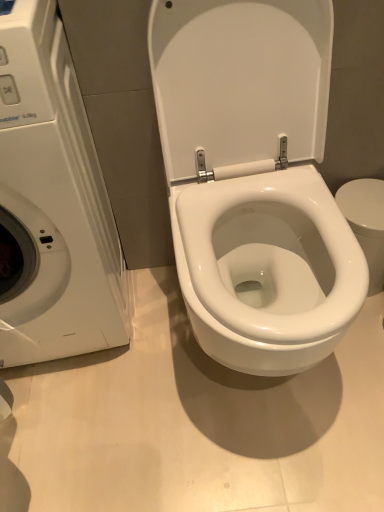
The width and height of the screenshot is (384, 512). I want to click on white glossy toilet at center, so click(253, 180).

What do you see at coordinates (253, 180) in the screenshot? This screenshot has width=384, height=512. I see `white glossy toilet at center` at bounding box center [253, 180].

Describe the element at coordinates (52, 203) in the screenshot. I see `white glossy washing machine at left` at that location.

Identify the location of white glossy washing machine at left. Image resolution: width=384 pixels, height=512 pixels. (52, 203).

I want to click on white glossy toilet at center, so click(253, 180).

Is white glossy washing machine at left to the left or to the right of white glossy toilet at center in the image?

In the image, white glossy washing machine at left appears on the left side of white glossy toilet at center.

In the scene shown: Considering the positions of objects white glossy washing machine at left and white glossy toilet at center in the image provided, who is behind, white glossy washing machine at left or white glossy toilet at center?

Positioned behind is white glossy toilet at center.

Which is less distant, (59,328) or (276,67)?

Point (59,328) appears to be farther away from the viewer than point (276,67).

From the image's perspective, which one is positioned higher, white glossy washing machine at left or white glossy toilet at center?

white glossy toilet at center is shown above in the image.

From a real-world perspective, who is located lower, white glossy washing machine at left or white glossy toilet at center?

In real-world perspective, white glossy washing machine at left is lower.

From the picture: Looking at their sizes, would you say white glossy washing machine at left is wider or thinner than white glossy toilet at center?

In the image, white glossy washing machine at left appears to be wider than white glossy toilet at center.

Considering the sizes of objects white glossy washing machine at left and white glossy toilet at center in the image provided, who is taller, white glossy washing machine at left or white glossy toilet at center?

With more height is white glossy toilet at center.

From the picture: Which of these two, white glossy washing machine at left or white glossy toilet at center, is bigger?

white glossy washing machine at left.

Is white glossy washing machine at left situated inside white glossy toilet at center or outside?

white glossy washing machine at left lies outside white glossy toilet at center.

Is white glossy washing machine at left placed right next to white glossy toilet at center?

white glossy washing machine at left and white glossy toilet at center are clearly separated.

Is white glossy washing machine at left turned away from white glossy toilet at center?

No, white glossy washing machine at left is not facing the opposite direction of white glossy toilet at center.

Can you tell me how much white glossy washing machine at left and white glossy toilet at center differ in facing direction?

The facing directions of white glossy washing machine at left and white glossy toilet at center are 0.000215 degrees apart.

The width and height of the screenshot is (384, 512). Find the location of `washing machine in front of the white glossy toilet at center`. washing machine in front of the white glossy toilet at center is located at coordinates (52, 203).

Which is more to the right, white glossy toilet at center or white glossy washing machine at left?

white glossy toilet at center.

Is white glossy toilet at center in front of white glossy washing machine at left?

No, the depth of white glossy toilet at center is greater than that of white glossy washing machine at left.

Between point (239, 240) and point (25, 172), which one is positioned in front?

The point (25, 172) is in front.

From the image's perspective, is white glossy toilet at center over white glossy washing machine at left?

Yes, from the image's perspective, white glossy toilet at center is above white glossy washing machine at left.

From a real-world perspective, is white glossy toilet at center below white glossy washing machine at left?

Incorrect, from a real-world perspective, white glossy toilet at center is higher than white glossy washing machine at left.

Between white glossy toilet at center and white glossy washing machine at left, which one has smaller width?

Thinner between the two is white glossy toilet at center.

Does white glossy toilet at center have a lesser height compared to white glossy washing machine at left?

Incorrect, the height of white glossy toilet at center does not fall short of that of white glossy washing machine at left.

Based on their sizes in the image, would you say white glossy toilet at center is bigger or smaller than white glossy washing machine at left?

white glossy toilet at center is smaller than white glossy washing machine at left.

Is white glossy toilet at center situated inside white glossy washing machine at left or outside?

white glossy toilet at center is spatially situated outside white glossy washing machine at left.

Are white glossy toilet at center and white glossy washing machine at left far apart?

No, white glossy toilet at center is in close proximity to white glossy washing machine at left.

Is white glossy toilet at center aimed at white glossy washing machine at left?

No, white glossy toilet at center is not oriented towards white glossy washing machine at left.

Find the location of a particular element. toilet positioned vertically above the white glossy washing machine at left (from a real-world perspective) is located at coordinates (253, 180).

The image size is (384, 512). I want to click on washing machine beneath the white glossy toilet at center (from a real-world perspective), so click(52, 203).

Find the location of a particular element. toilet behind the white glossy washing machine at left is located at coordinates (253, 180).